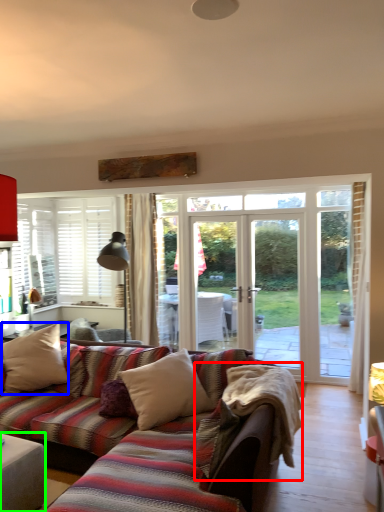
Question: Based on their relative distances, which object is nearer to blanket (highlighted by a red box)? Choose from pillow (highlighted by a blue box) and table (highlighted by a green box).

Choices:
 (A) pillow
 (B) table

Answer: (B)